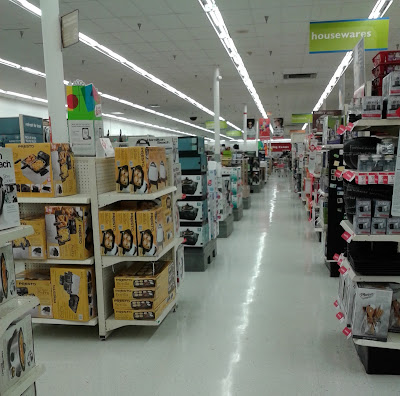
Find the location of `simple metal retail shelves`. simple metal retail shelves is located at coordinates (78, 200), (101, 176), (112, 197), (28, 305), (13, 234), (361, 237), (369, 279).